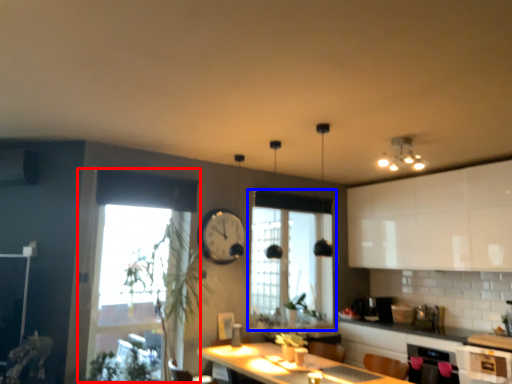
Question: Which object appears farthest to the camera in this image, window (highlighted by a red box) or window (highlighted by a blue box)?

Choices:
 (A) window
 (B) window

Answer: (B)